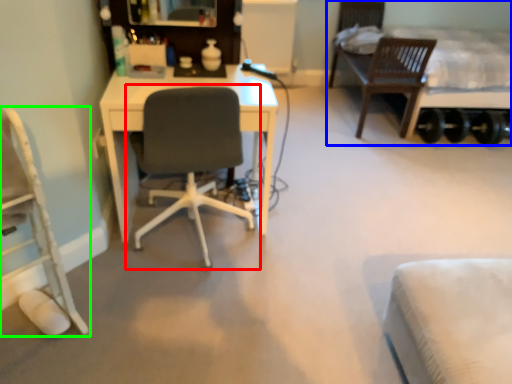
Question: Considering the real-world distances, which object is closest to chair (highlighted by a red box)? bed (highlighted by a blue box) or chair (highlighted by a green box).

Choices:
 (A) bed
 (B) chair

Answer: (B)